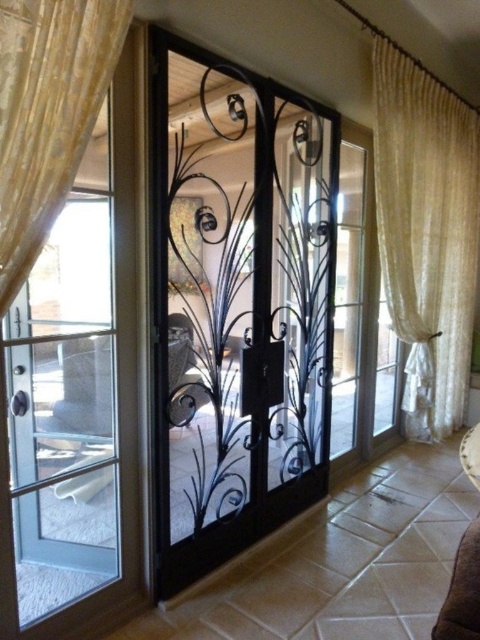
You are a guest approaching the French doors and notice the black wrought iron screen door at center and the gold textured curtain at upper left. Which object is located to the right of the other?

The black wrought iron screen door at center is positioned on the right side of gold textured curtain at upper left.

You are standing outside the French doors and want to enter the room. There are two curtains in view. Which curtain, the sheer white curtain at right or the gold textured curtain at upper left, is closer to your right side as you face the doors?

The sheer white curtain at right is closer to your right side as you face the doors because it is positioned to the right of the gold textured curtain at upper left.